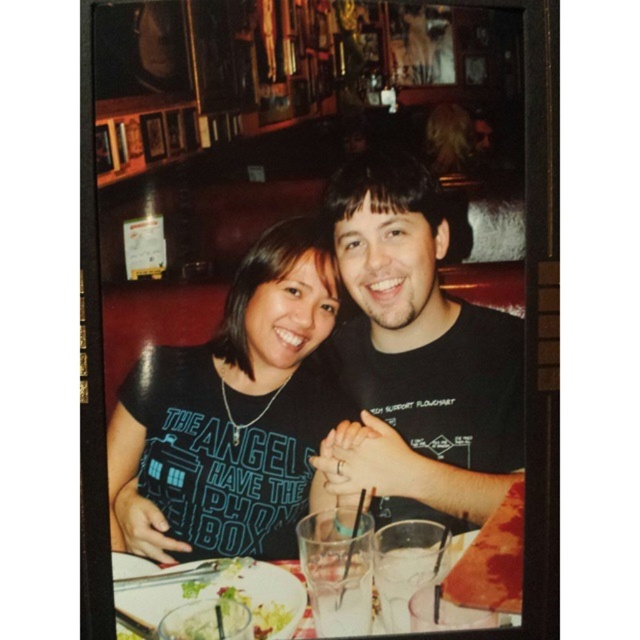
Does black matte t-shirt at center have a greater height compared to clear glassware at center?

Yes, black matte t-shirt at center is taller than clear glassware at center.

Can you confirm if black matte t-shirt at center is shorter than clear glassware at center?

In fact, black matte t-shirt at center may be taller than clear glassware at center.

I want to click on black matte t-shirt at center, so click(x=419, y=358).

Which is in front, point (241, 520) or point (348, 376)?

Point (241, 520) is more forward.

Can you confirm if black matte shirt at center is positioned to the left of black matte t-shirt at center?

Indeed, black matte shirt at center is positioned on the left side of black matte t-shirt at center.

Where is `black matte shirt at center`? Image resolution: width=640 pixels, height=640 pixels. black matte shirt at center is located at coordinates (232, 413).

You are a GUI agent. You are given a task and a screenshot of the screen. Output one action in this format:
    pyautogui.click(x=<x>, y=<y>)
    Task: Click on the black matte shirt at center
    
    Given the screenshot: What is the action you would take?
    (232, 413)

Between point (289, 547) and point (120, 634), which one is positioned behind?

Positioned behind is point (289, 547).

Can you confirm if black matte shirt at center is bigger than clear glassware at center?

Correct, black matte shirt at center is larger in size than clear glassware at center.

Find the location of a particular element. black matte shirt at center is located at coordinates (232, 413).